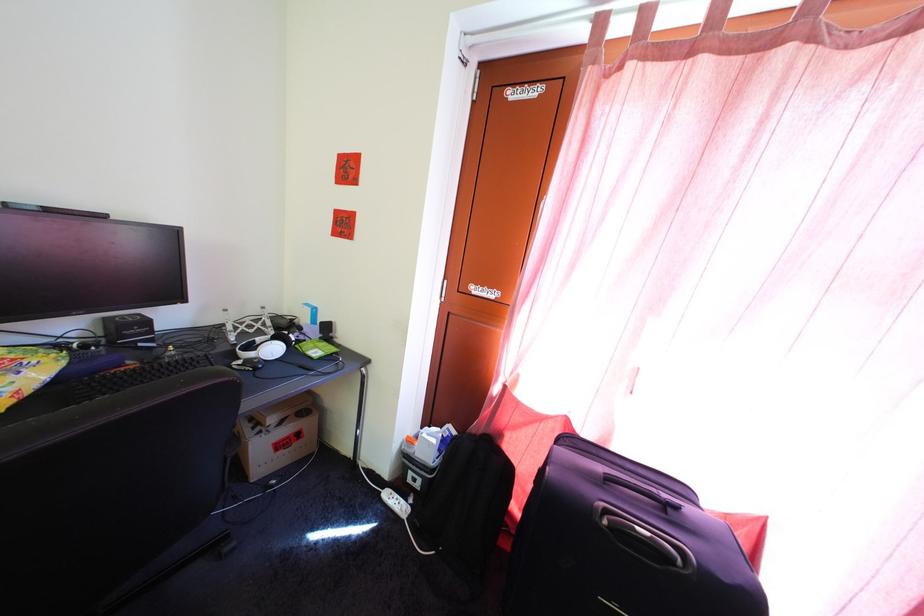
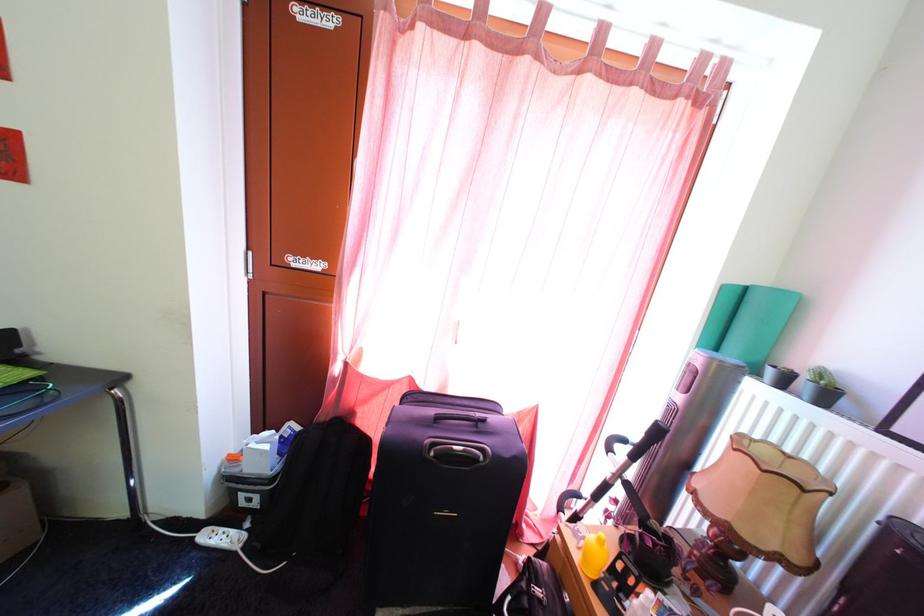
Locate, in the second image, the point that corresponds to the point at 614,521 in the first image.

(441, 454)